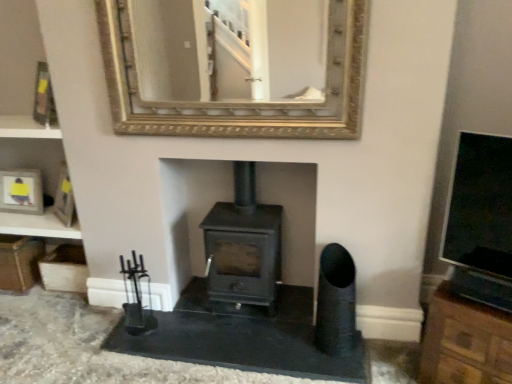
What do you see at coordinates (243, 245) in the screenshot? The image size is (512, 384). I see `black matte wood burning stove at center` at bounding box center [243, 245].

You are a GUI agent. You are given a task and a screenshot of the screen. Output one action in this format:
    pyautogui.click(x=<x>, y=<y>)
    Task: Click on the brown wood cabinet at right
    The image size is (512, 384).
    Given the screenshot: What is the action you would take?
    pyautogui.click(x=465, y=342)

What's the angular difference between black matte wood burning stove at center and gold-framed mirror at upper center's facing directions?

black matte wood burning stove at center and gold-framed mirror at upper center are facing 0.588 degrees away from each other.

Is black matte wood burning stove at center positioned behind gold-framed mirror at upper center?

Yes, black matte wood burning stove at center is further from the viewer.

Would you say black matte wood burning stove at center is outside gold-framed mirror at upper center?

Yes, black matte wood burning stove at center is outside of gold-framed mirror at upper center.

Who is taller, black matte wood burning stove at center or gold-framed mirror at upper center?

gold-framed mirror at upper center is taller.

From the image's perspective, which object appears higher, metallic gold picture frame at upper left or gold-framed mirror at upper center?

From the image's view, gold-framed mirror at upper center is above.

In terms of width, does metallic gold picture frame at upper left look wider or thinner when compared to gold-framed mirror at upper center?

Clearly, metallic gold picture frame at upper left has more width compared to gold-framed mirror at upper center.

Is metallic gold picture frame at upper left located outside gold-framed mirror at upper center?

Absolutely, metallic gold picture frame at upper left is external to gold-framed mirror at upper center.

Is metallic gold picture frame at upper left positioned in front of gold-framed mirror at upper center?

That is False.

Considering the sizes of black matte wood burning stove at center and brown wood cabinet at right in the image, is black matte wood burning stove at center bigger or smaller than brown wood cabinet at right?

In the image, black matte wood burning stove at center appears to be smaller than brown wood cabinet at right.

Does black matte wood burning stove at center appear on the right side of brown wood cabinet at right?

In fact, black matte wood burning stove at center is to the left of brown wood cabinet at right.

Image resolution: width=512 pixels, height=384 pixels. I want to click on wood burning stove on the left of brown wood cabinet at right, so click(x=243, y=245).

Does black matte wood burning stove at center have a lesser height compared to brown wood cabinet at right?

In fact, black matte wood burning stove at center may be taller than brown wood cabinet at right.

Is brown wood cabinet at right to the left or to the right of black matte wood burning stove at center in the image?

From the image, it's evident that brown wood cabinet at right is to the right of black matte wood burning stove at center.

Is brown wood cabinet at right placed right next to black matte wood burning stove at center?

No, brown wood cabinet at right is not touching black matte wood burning stove at center.

In the image, is brown wood cabinet at right positioned in front of or behind black matte wood burning stove at center?

brown wood cabinet at right is positioned closer to the viewer than black matte wood burning stove at center.

Is gold-framed mirror at upper center further to camera compared to metallic gold picture frame at upper left?

That is False.

Can we say gold-framed mirror at upper center lies outside metallic gold picture frame at upper left?

Yes, gold-framed mirror at upper center is not within metallic gold picture frame at upper left.

From the image's perspective, which one is positioned lower, gold-framed mirror at upper center or metallic gold picture frame at upper left?

From the image's view, metallic gold picture frame at upper left is below.

Measure the distance between gold-framed mirror at upper center and metallic gold picture frame at upper left.

They are 3.32 feet apart.

Can you confirm if metallic gold picture frame at upper left is smaller than brown wood cabinet at right?

Correct, metallic gold picture frame at upper left occupies less space than brown wood cabinet at right.

Which object is closer to the camera taking this photo, metallic gold picture frame at upper left or brown wood cabinet at right?

Positioned in front is brown wood cabinet at right.

Considering the sizes of objects metallic gold picture frame at upper left and brown wood cabinet at right in the image provided, who is taller, metallic gold picture frame at upper left or brown wood cabinet at right?

brown wood cabinet at right.

Is metallic gold picture frame at upper left inside or outside of brown wood cabinet at right?

The correct answer is: outside.

Between gold-framed mirror at upper center and black matte wood burning stove at center, which one has larger width?

Wider between the two is black matte wood burning stove at center.

The height and width of the screenshot is (384, 512). I want to click on wood burning stove behind the gold-framed mirror at upper center, so click(243, 245).

Is point (314, 117) closer to camera compared to point (280, 243)?

That is True.

Where is `wood burning stove that appears on the right of gold-framed mirror at upper center`? Image resolution: width=512 pixels, height=384 pixels. wood burning stove that appears on the right of gold-framed mirror at upper center is located at coordinates (243, 245).

Locate an element on the screen. Image resolution: width=512 pixels, height=384 pixels. mirror above the metallic gold picture frame at upper left (from the image's perspective) is located at coordinates (234, 67).

When comparing their distances from gold-framed mirror at upper center, does brown wood cabinet at right or black matte wood burning stove at center seem closer?

Based on the image, black matte wood burning stove at center appears to be nearer to gold-framed mirror at upper center.

From the image, which object appears to be farther from brown wood cabinet at right, metallic gold picture frame at upper left or gold-framed mirror at upper center?

metallic gold picture frame at upper left.

Considering their positions, is gold-framed mirror at upper center positioned further to brown wood cabinet at right than black matte wood burning stove at center?

gold-framed mirror at upper center is further to brown wood cabinet at right.

Which object lies nearer to the anchor point black matte wood burning stove at center, brown wood cabinet at right or metallic gold picture frame at upper left?

Among the two, brown wood cabinet at right is located nearer to black matte wood burning stove at center.

From the image, which object appears to be nearer to gold-framed mirror at upper center, black matte wood burning stove at center or metallic gold picture frame at upper left?

black matte wood burning stove at center is closer to gold-framed mirror at upper center.

Estimate the real-world distances between objects in this image. Which object is closer to black matte wood burning stove at center, gold-framed mirror at upper center or brown wood cabinet at right?

gold-framed mirror at upper center.

Considering their positions, is gold-framed mirror at upper center positioned closer to metallic gold picture frame at upper left than black matte wood burning stove at center?

Based on the image, gold-framed mirror at upper center appears to be nearer to metallic gold picture frame at upper left.

Considering their positions, is gold-framed mirror at upper center positioned closer to metallic gold picture frame at upper left than brown wood cabinet at right?

Among the two, gold-framed mirror at upper center is located nearer to metallic gold picture frame at upper left.

Identify the location of mirror between metallic gold picture frame at upper left and brown wood cabinet at right. (234, 67).

Locate an element on the screen. The image size is (512, 384). wood burning stove situated between metallic gold picture frame at upper left and brown wood cabinet at right from left to right is located at coordinates (243, 245).

Where is `mirror between metallic gold picture frame at upper left and black matte wood burning stove at center`? The height and width of the screenshot is (384, 512). mirror between metallic gold picture frame at upper left and black matte wood burning stove at center is located at coordinates (234, 67).

Where is `wood burning stove located between gold-framed mirror at upper center and brown wood cabinet at right in the left-right direction`? The width and height of the screenshot is (512, 384). wood burning stove located between gold-framed mirror at upper center and brown wood cabinet at right in the left-right direction is located at coordinates (243, 245).